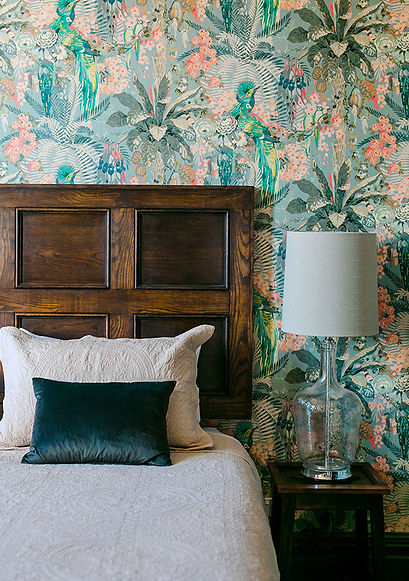
Where is `glass`? glass is located at coordinates (319, 433).